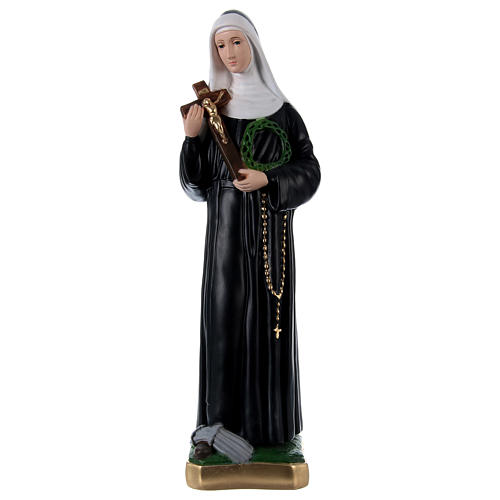
At what (x,y) coordinates should I click in order to perform the action: click on green wreath. Please return your answer as a coordinate pair (x, y). The image size is (500, 500). Looking at the image, I should click on (250, 150).